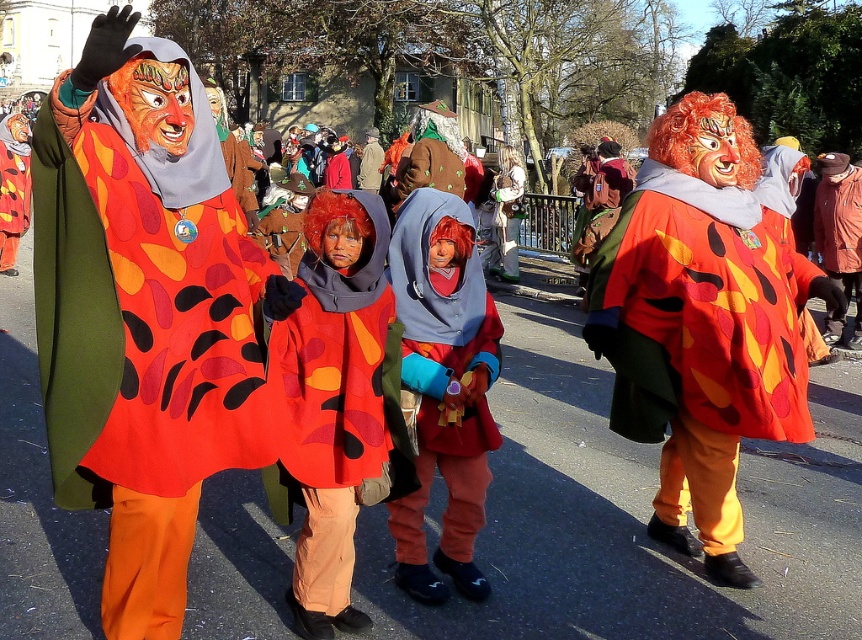
Question: Which object appears farthest from the camera in this image?

Choices:
 (A) matte orange fabric mask at upper left
 (B) matte red cape at center

Answer: (B)

Question: Can you confirm if flame-patterned fabric joker at center is positioned to the left of matte fabric costume at center?

Choices:
 (A) yes
 (B) no

Answer: (B)

Question: Is matte orange fabric mask at upper left bigger than matte fabric costume at center?

Choices:
 (A) yes
 (B) no

Answer: (A)

Question: Does flame-patterned fabric joker at center appear over matte fabric costume at center?

Choices:
 (A) no
 (B) yes

Answer: (B)

Question: Which object is positioned closest to the flame-patterned fabric joker at center?

Choices:
 (A) matte fabric costume at center
 (B) matte orange fabric mask at upper left

Answer: (A)

Question: Which object is farther from the camera taking this photo?

Choices:
 (A) matte red cape at center
 (B) matte fabric costume at center
 (C) flame-patterned fabric joker at center

Answer: (C)